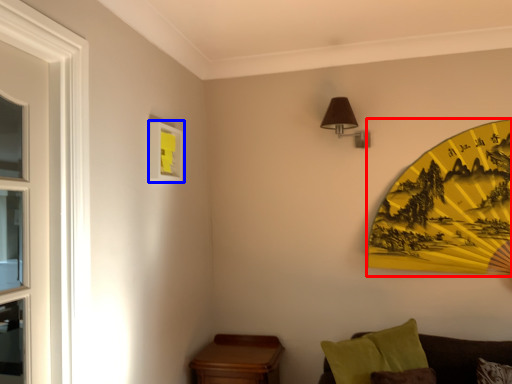
Question: Which point is further to the camera, design (highlighted by a red box) or picture frame (highlighted by a blue box)?

Choices:
 (A) design
 (B) picture frame

Answer: (A)